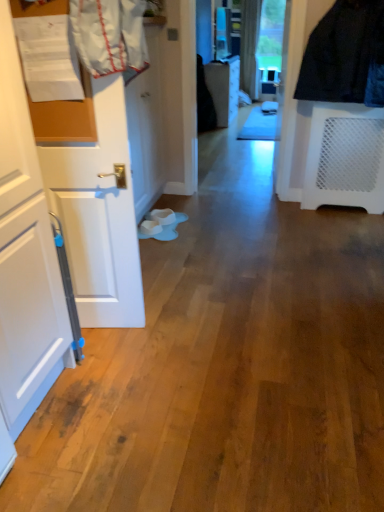
Question: From a real-world perspective, is white glossy door at center, the 1th door viewed from the back, above or below white matte door at left, positioned as the 1th door in front-to-back order?

Choices:
 (A) below
 (B) above

Answer: (A)

Question: Is white glossy door at center, the 1th door viewed from the back, spatially inside white matte door at left, positioned as the 1th door in front-to-back order, or outside of it?

Choices:
 (A) outside
 (B) inside

Answer: (A)

Question: Estimate the real-world distances between objects in this image. Which object is farther from the white glossy door at center, the 1th door viewed from the back?

Choices:
 (A) white matte door at left, positioned as the 1th door in front-to-back order
 (B) white fabric laundry at upper left

Answer: (B)

Question: Estimate the real-world distances between objects in this image. Which object is farther from the white matte door at left, the second door viewed from the back?

Choices:
 (A) white glossy door at center, the 1th door viewed from the back
 (B) white fabric laundry at upper left

Answer: (A)